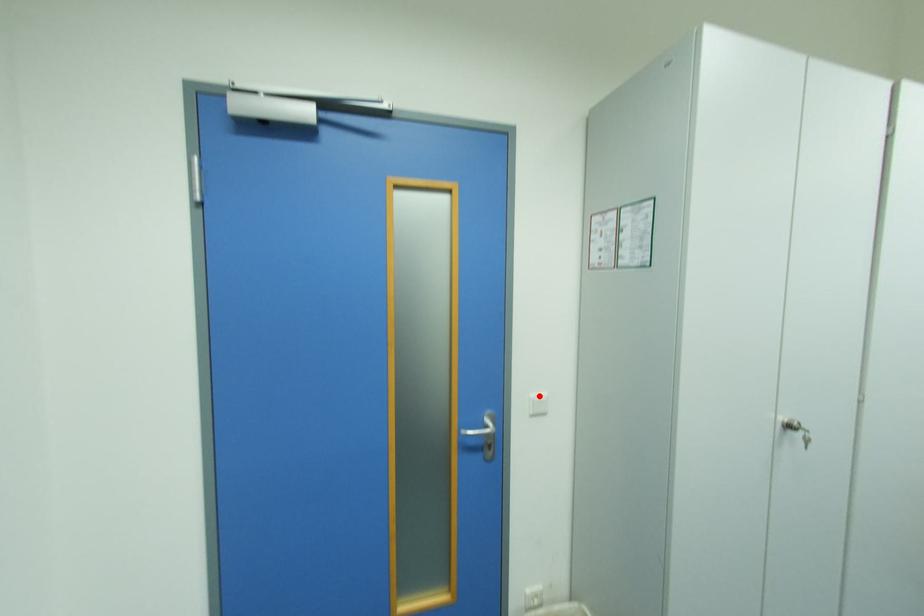
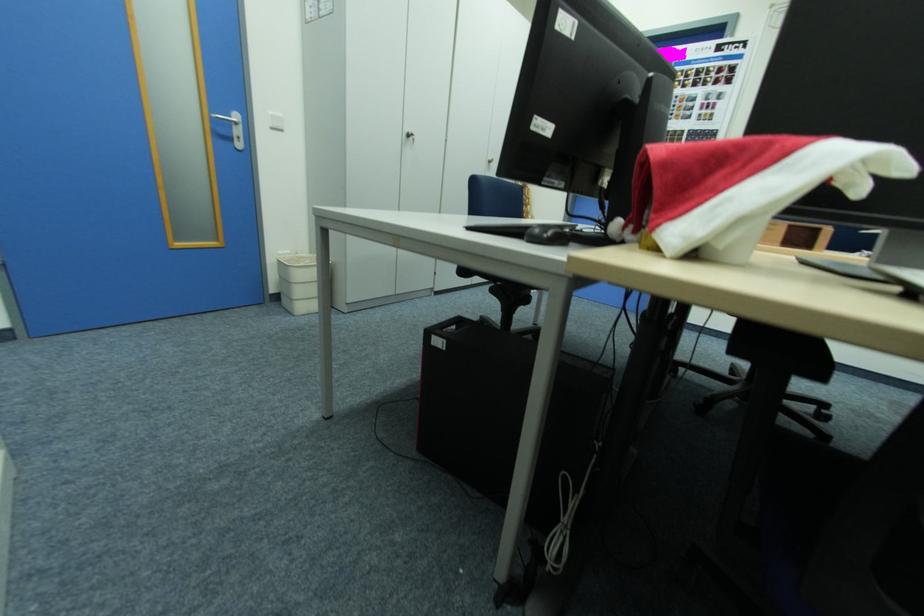
Where in the second image is the point corresponding to the highlighted location from the first image?

(277, 114)